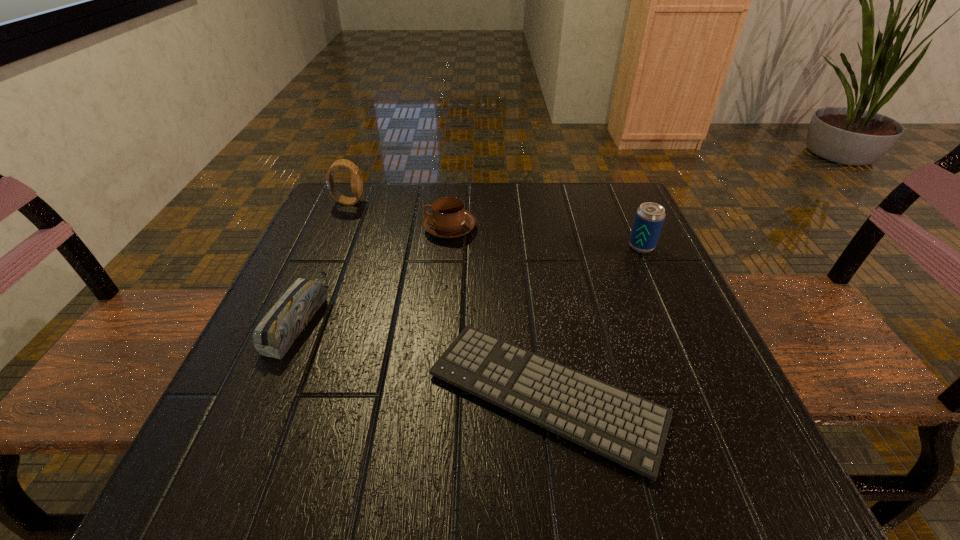
Locate an element on the screen. This screenshot has width=960, height=540. the farthest object is located at coordinates (356, 181).

Identify the location of beer can. The height and width of the screenshot is (540, 960). (649, 218).

This screenshot has height=540, width=960. I want to click on cappuccino, so click(x=448, y=219).

Identify the location of pencil box. The image size is (960, 540). (274, 335).

I want to click on the shortest object, so click(623, 427).

Identify the location of blank space located 0.210m on the face of the watch. The image size is (960, 540). (450, 202).

At what (x,y) coordinates should I click in order to perform the action: click on free spot located 0.050m on the front of the rightmost object. Please return your answer as a coordinate pair (x, y). Looking at the image, I should click on (x=652, y=270).

Find the location of a particular element. vacant space located on the side of the cappuccino with the handle is located at coordinates (388, 228).

In order to click on blank space located 0.200m on the side of the cappuccino with the handle in this screenshot , I will do `click(334, 228)`.

This screenshot has width=960, height=540. In order to click on vacant space situated 0.230m on the side of the cappuccino with the handle in this screenshot , I will do `click(321, 228)`.